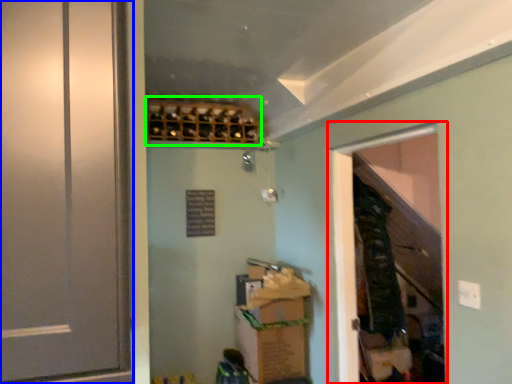
Question: Estimate the real-world distances between objects in this image. Which object is farther from screen door (highlighted by a red box), door (highlighted by a blue box) or wine rack (highlighted by a green box)?

Choices:
 (A) door
 (B) wine rack

Answer: (A)